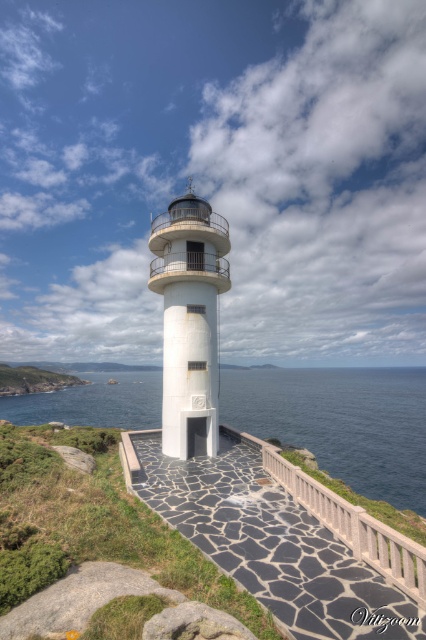
Does black stone path at center appear under white smooth lighthouse at center?

Indeed, black stone path at center is positioned under white smooth lighthouse at center.

Between black stone path at center and white smooth lighthouse at center, which one appears on the right side from the viewer's perspective?

Positioned to the right is black stone path at center.

Between point (207, 483) and point (154, 230), which one is positioned in front?

Point (207, 483) is more forward.

Where is `black stone path at center`? The width and height of the screenshot is (426, 640). black stone path at center is located at coordinates (284, 538).

Between blue water at center and white smooth lighthouse at center, which one appears on the left side from the viewer's perspective?

Positioned to the left is white smooth lighthouse at center.

Is the position of blue water at center more distant than that of white smooth lighthouse at center?

Yes, blue water at center is behind white smooth lighthouse at center.

Between point (285, 397) and point (195, 289), which one is positioned in front?

Positioned in front is point (195, 289).

You are a GUI agent. You are given a task and a screenshot of the screen. Output one action in this format:
    pyautogui.click(x=<x>, y=<y>)
    Task: Click on the blue water at center
    Image resolution: width=426 pixels, height=640 pixels.
    Given the screenshot: What is the action you would take?
    pyautogui.click(x=340, y=422)

Between black stone path at center and blue water at center, which one has less height?

black stone path at center is shorter.

Is the position of black stone path at center less distant than that of blue water at center?

That is True.

The width and height of the screenshot is (426, 640). What are the coordinates of `black stone path at center` in the screenshot? It's located at (284, 538).